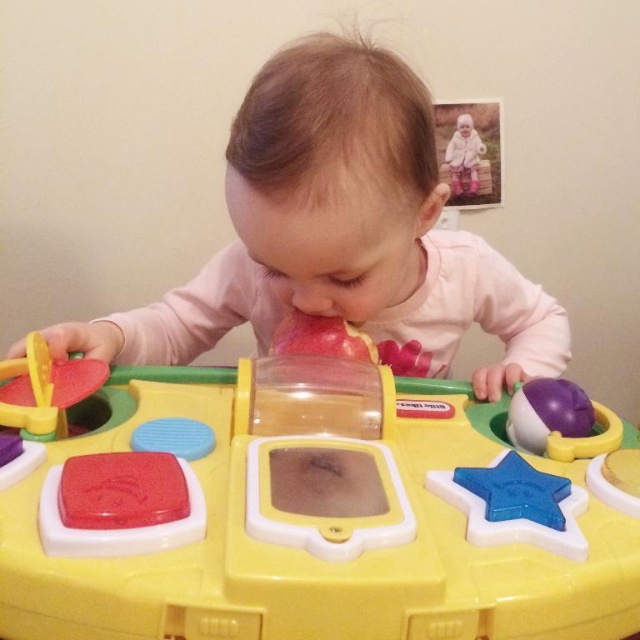
Is yellow plastic toy at center in front of pink matte toy at center?

Yes, yellow plastic toy at center is in front of pink matte toy at center.

Is point (582, 531) closer to viewer compared to point (460, 243)?

That is True.

Locate an element on the screen. The width and height of the screenshot is (640, 640). yellow plastic toy at center is located at coordinates [305, 509].

Can you confirm if pink matte toy at center is smaller than white matte baby at upper right?

Actually, pink matte toy at center might be larger than white matte baby at upper right.

Is pink matte toy at center to the left of white matte baby at upper right from the viewer's perspective?

Correct, you'll find pink matte toy at center to the left of white matte baby at upper right.

Between point (269, 324) and point (445, 148), which one is positioned behind?

The point (445, 148) is behind.

Where is `pink matte toy at center`? The width and height of the screenshot is (640, 640). pink matte toy at center is located at coordinates (340, 232).

Is yellow plastic toy at center to the left of white matte baby at upper right from the viewer's perspective?

Indeed, yellow plastic toy at center is positioned on the left side of white matte baby at upper right.

How much distance is there between yellow plastic toy at center and white matte baby at upper right?

The distance of yellow plastic toy at center from white matte baby at upper right is 4.34 feet.

Is point (324, 586) closer to viewer compared to point (460, 125)?

Yes, point (324, 586) is closer to viewer.

Where is `yellow plastic toy at center`? yellow plastic toy at center is located at coordinates 305,509.